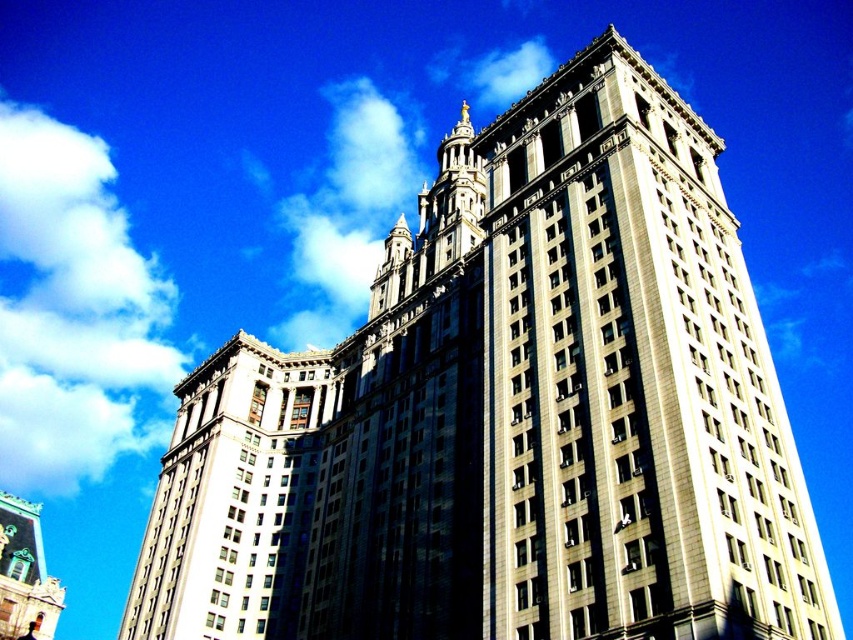
Question: Where is white fluffy cloud at upper left located in relation to white marble tower at center in the image?

Choices:
 (A) left
 (B) right

Answer: (A)

Question: Is white marble tower at center to the left of green copper dome at lower left from the viewer's perspective?

Choices:
 (A) no
 (B) yes

Answer: (A)

Question: Observing the image, what is the correct spatial positioning of white marble tower at center in reference to green copper dome at lower left?

Choices:
 (A) above
 (B) below

Answer: (A)

Question: Which object is the closest to the green copper dome at lower left?

Choices:
 (A) white fluffy cloud at upper left
 (B) white marble tower at center

Answer: (B)

Question: Which point appears closest to the camera in this image?

Choices:
 (A) (71, 305)
 (B) (35, 516)

Answer: (B)

Question: Which is farther from the white fluffy cloud at upper left?

Choices:
 (A) green copper dome at lower left
 (B) white marble tower at center

Answer: (B)